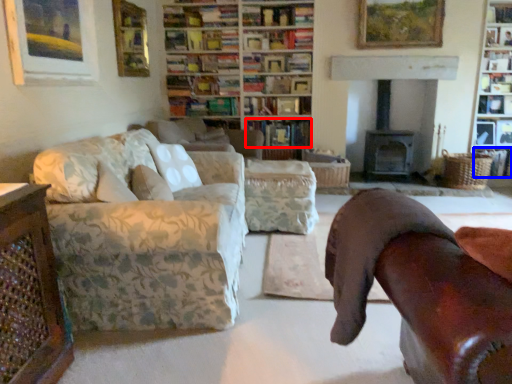
Question: Which of the following is the closest to the observer, book (highlighted by a red box) or book (highlighted by a blue box)?

Choices:
 (A) book
 (B) book

Answer: (B)